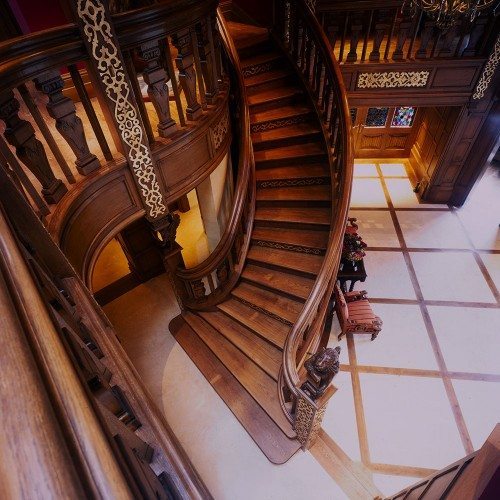
At what (x,y) coordinates should I click in order to perform the action: click on yellow ornaments. Please return your answer as a coordinate pair (x, y). This screenshot has height=500, width=500. Looking at the image, I should click on (153, 174), (402, 78), (487, 70).